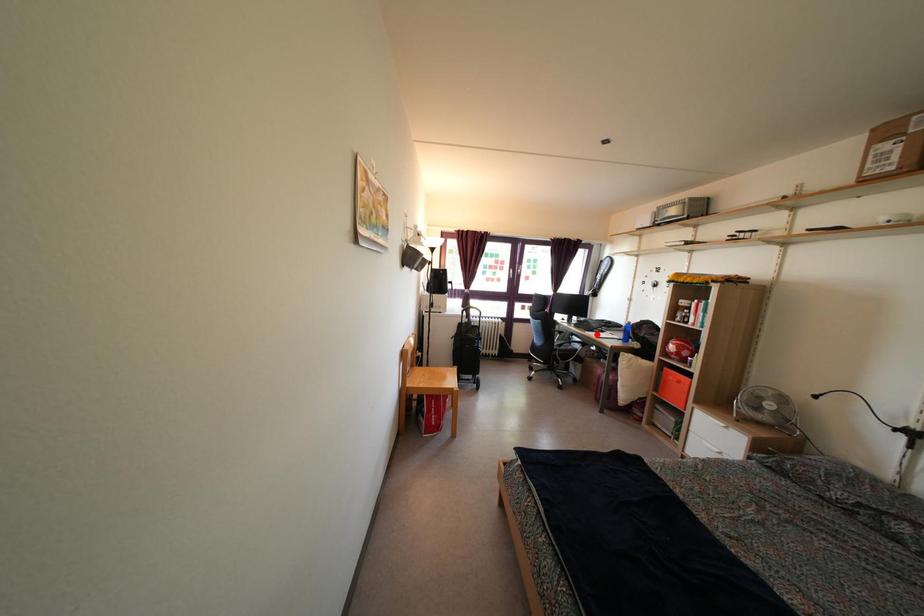
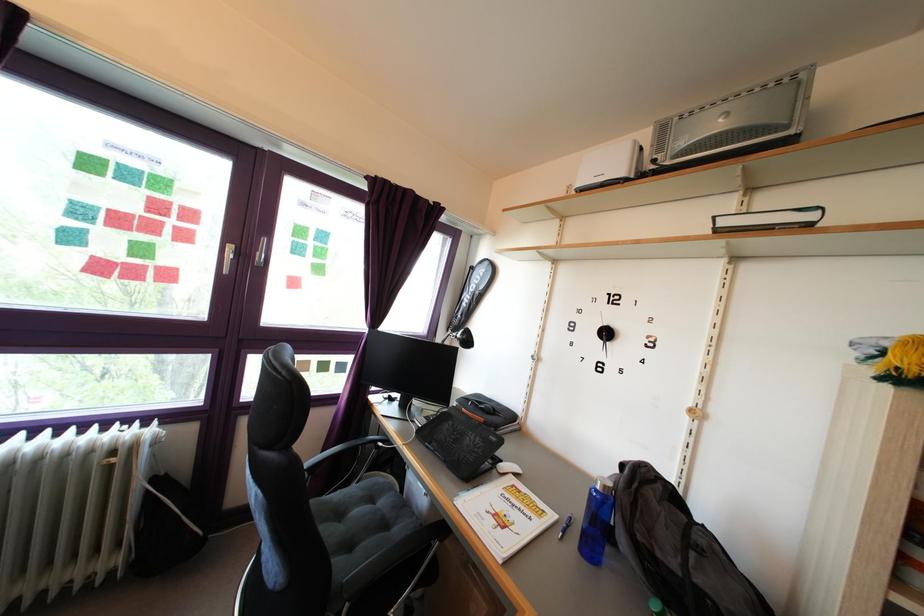
Find the pixel in the second image that matches the highlighted location in the first image.

(472, 447)